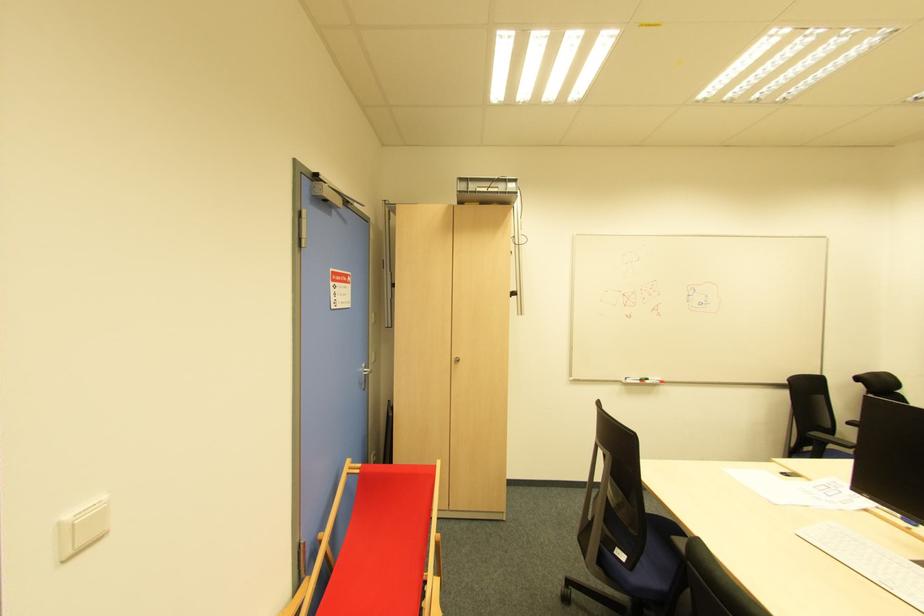
You are a GUI agent. You are given a task and a screenshot of the screen. Output one action in this format:
    pyautogui.click(x=<x>, y=<y>)
    Task: Click on the cabinet keyhole
    The height and width of the screenshot is (616, 924).
    Given the screenshot: What is the action you would take?
    pyautogui.click(x=456, y=360)